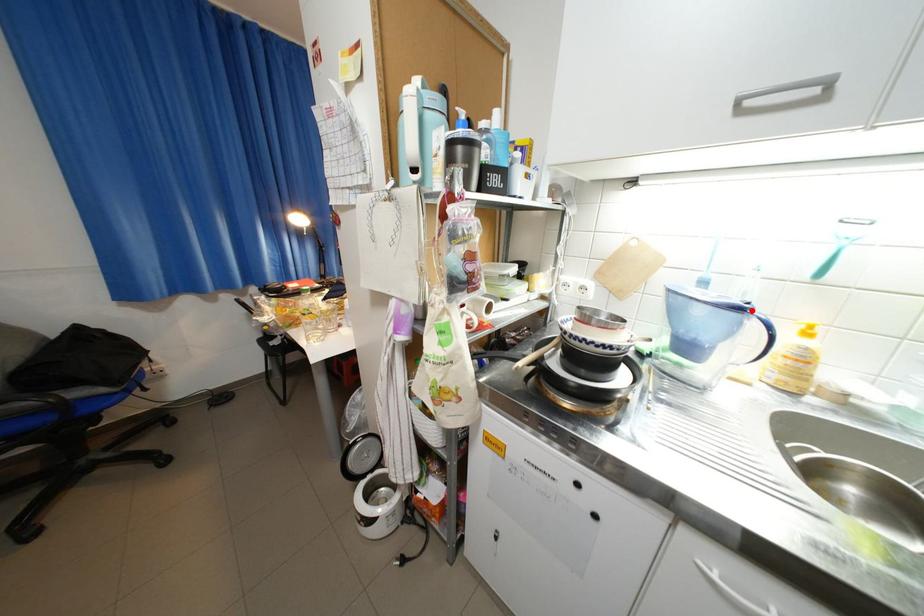
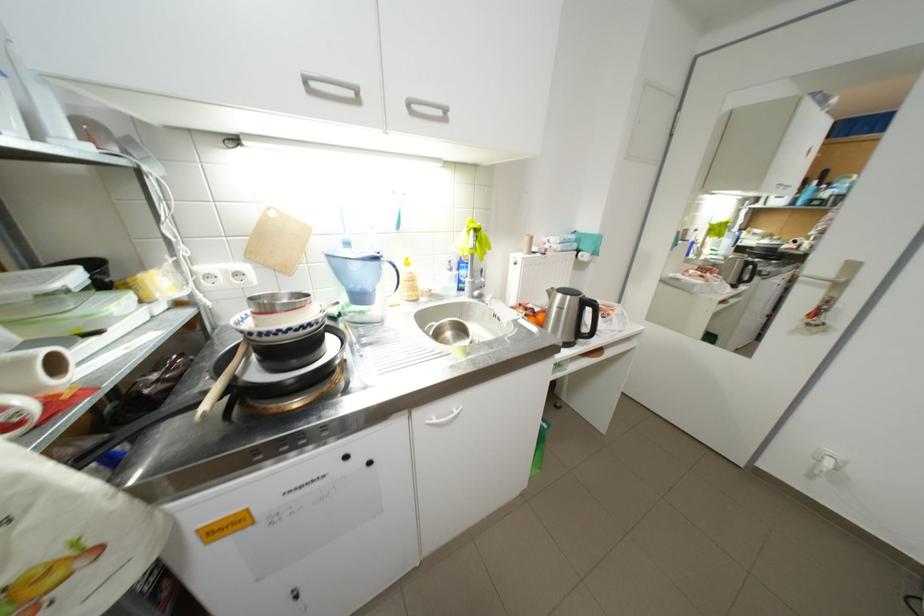
The point at the highlighted location is marked in the first image. Where is the corresponding point in the second image?

(387, 259)